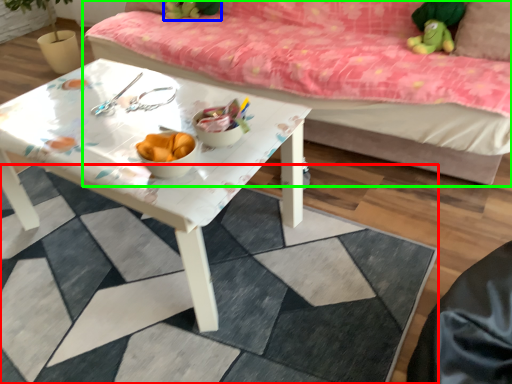
Question: Considering the real-world distances, which object is closest to tile (highlighted by a red box)? toy (highlighted by a blue box) or studio couch (highlighted by a green box).

Choices:
 (A) toy
 (B) studio couch

Answer: (B)